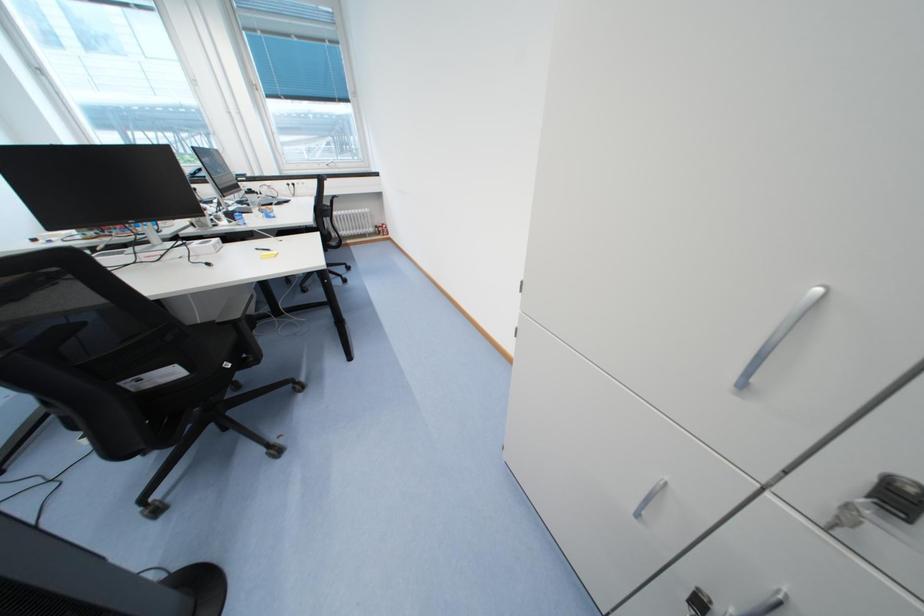
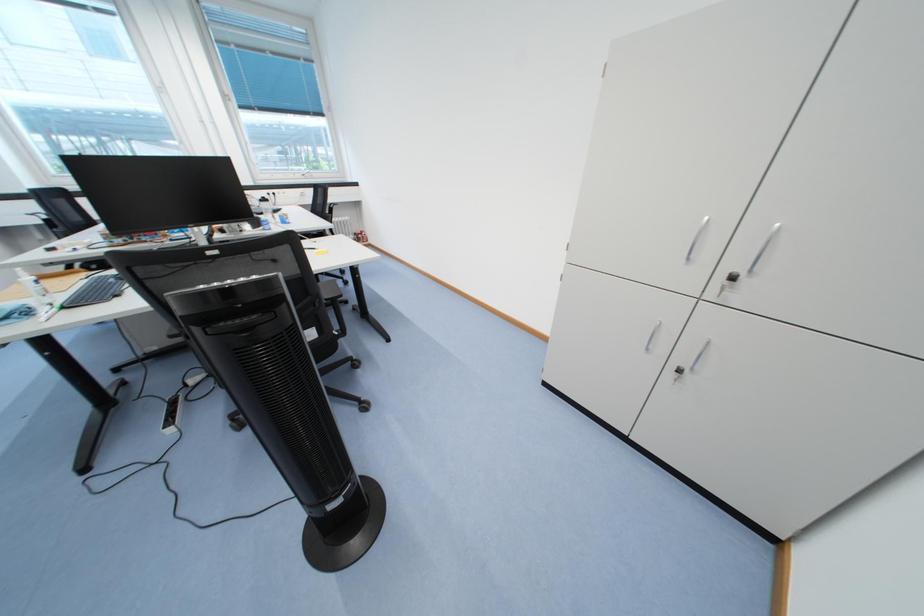
Question: The camera is either moving clockwise (left) or counter-clockwise (right) around the object. The first image is from the beginning of the video and the second image is from the end. Is the camera moving left or right when shooting the video?

Choices:
 (A) Left
 (B) Right

Answer: (A)